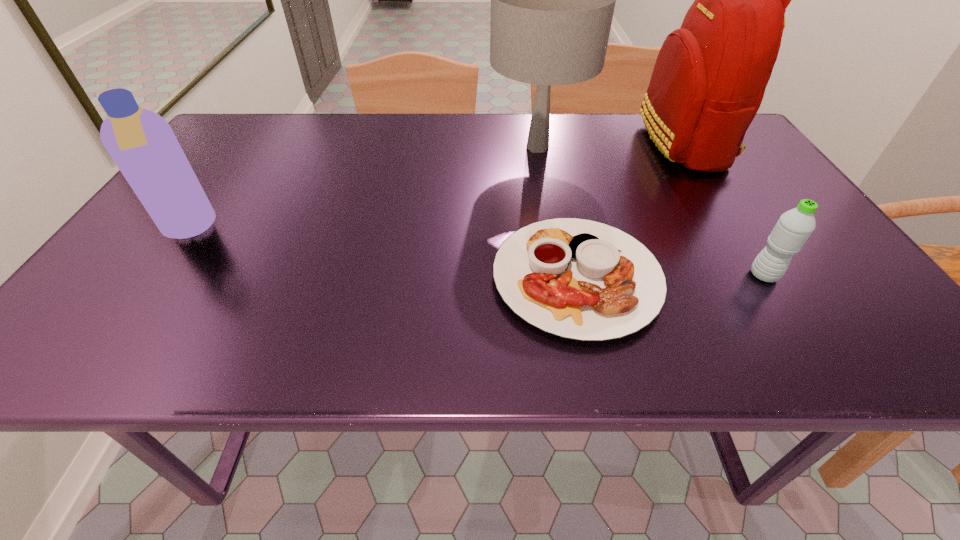
Locate an element on the screen. Image resolution: width=960 pixels, height=540 pixels. backpack is located at coordinates (709, 79).

At what (x,y) coordinates should I click in order to perform the action: click on the second tallest object. Please return your answer as a coordinate pair (x, y). Image resolution: width=960 pixels, height=540 pixels. Looking at the image, I should click on (552, 0).

Locate an element on the screen. shampoo is located at coordinates (142, 144).

Where is `the third shortest object`? the third shortest object is located at coordinates (142, 144).

You are a GUI agent. You are given a task and a screenshot of the screen. Output one action in this format:
    pyautogui.click(x=<x>, y=<y>)
    Task: Click on the fourth tallest object
    
    Given the screenshot: What is the action you would take?
    pyautogui.click(x=794, y=227)

Image resolution: width=960 pixels, height=540 pixels. In order to click on the shortest object in this screenshot , I will do `click(580, 279)`.

In order to click on vacant area located on the front-facing side of the backpack in this screenshot , I will do `click(532, 143)`.

The height and width of the screenshot is (540, 960). Find the location of `free location located 0.330m on the front-facing side of the backpack`. free location located 0.330m on the front-facing side of the backpack is located at coordinates (524, 143).

Locate an element on the screen. The image size is (960, 540). vacant space located 0.200m on the front-facing side of the backpack is located at coordinates (571, 143).

This screenshot has width=960, height=540. What are the coordinates of `free space located on the front-facing side of the fourth shortest object` in the screenshot? It's located at (470, 147).